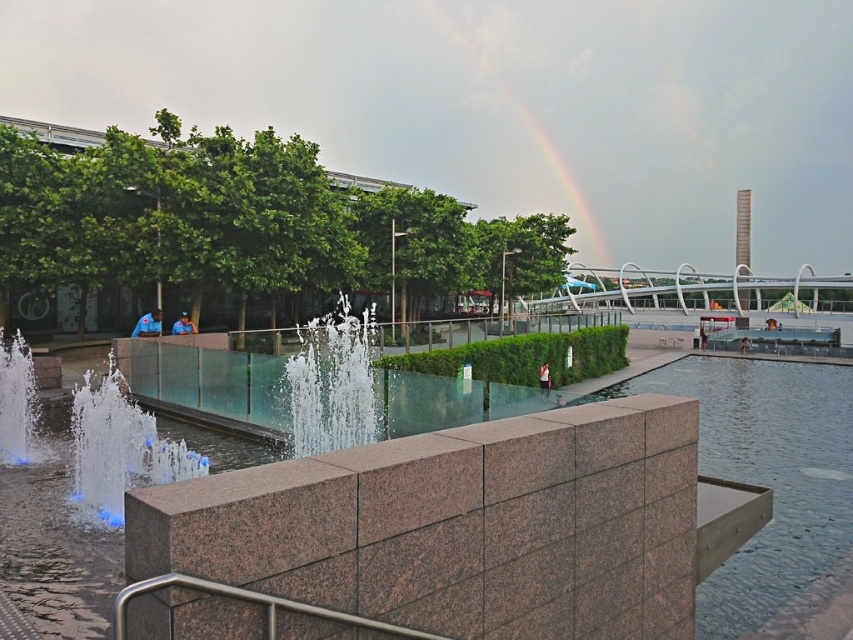
Is clear glass water at center in front of green leafy trees at left?

Yes, it is in front of green leafy trees at left.

Describe the element at coordinates (769, 474) in the screenshot. This screenshot has width=853, height=640. I see `clear glass water at center` at that location.

Identify the location of clear glass water at center. (769, 474).

Does clear water fountain at center appear under green leafy trees at left?

Correct, clear water fountain at center is located below green leafy trees at left.

Where is `clear water fountain at center`? This screenshot has height=640, width=853. clear water fountain at center is located at coordinates (332, 381).

Identify the location of clear water fountain at center. The width and height of the screenshot is (853, 640). (332, 381).

Does blue-lit water at lower left come in front of green leafy trees at left?

Yes, blue-lit water at lower left is closer to the viewer.

Does blue-lit water at lower left appear on the left side of green leafy trees at left?

In fact, blue-lit water at lower left is to the right of green leafy trees at left.

Locate an element on the screen. This screenshot has width=853, height=640. blue-lit water at lower left is located at coordinates (119, 449).